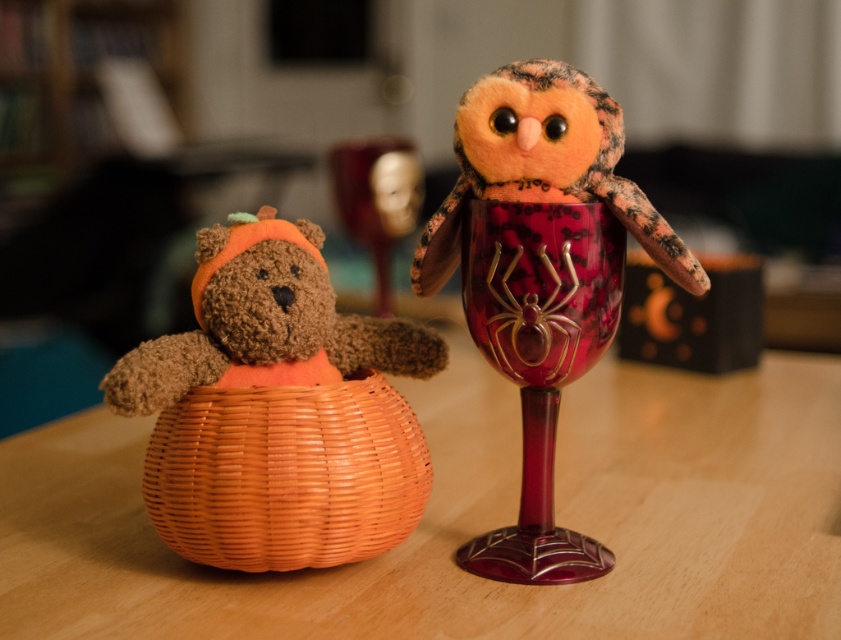
You are arranging Halloween decorations and need to place a small tealight candle between the velvety orange owl at center and the orange wicker basket at lower left. Based on their positions, where should you place the candle?

The velvety orange owl at center is to the right of the orange wicker basket at lower left, so you should place the tealight candle between them, closer to the orange wicker basket at lower left since the owl is positioned to its right.